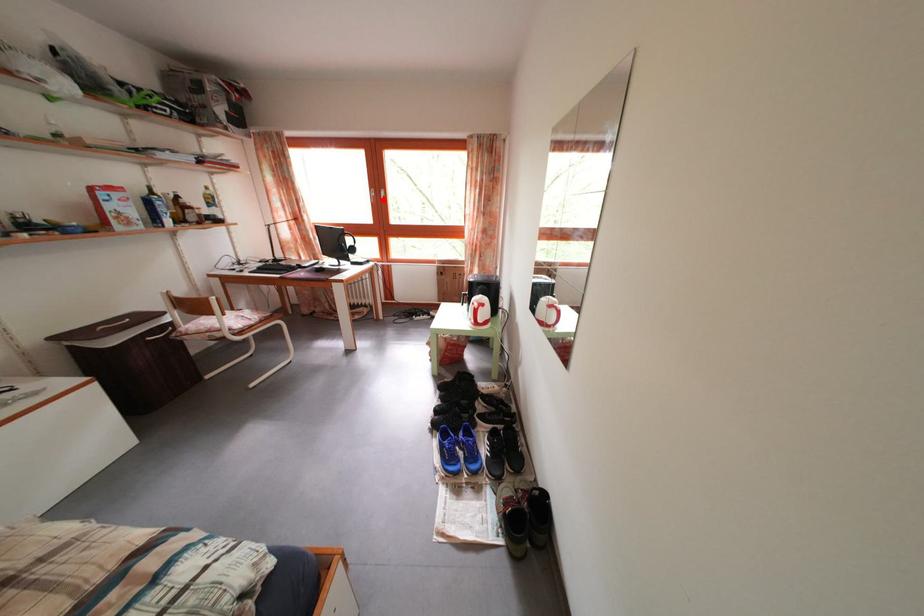
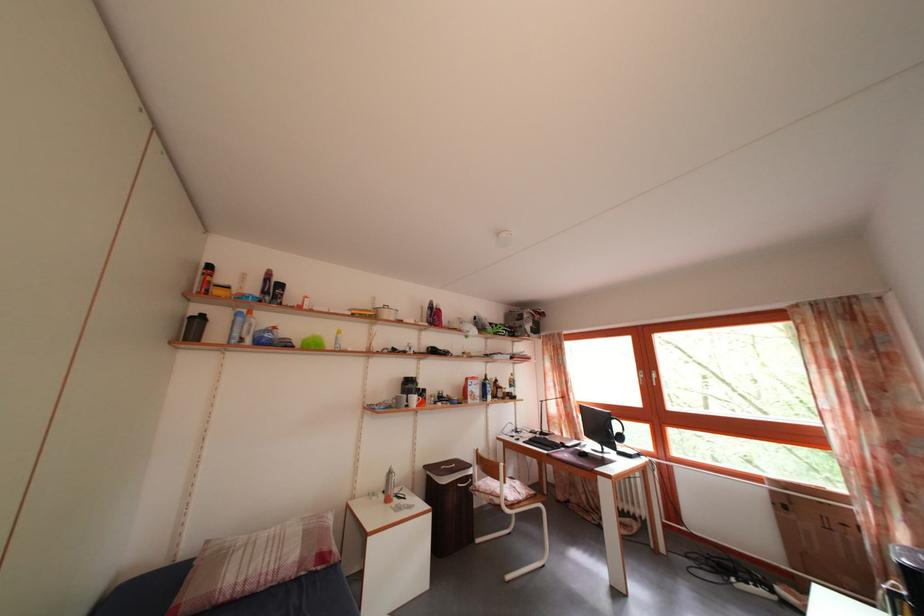
Where in the second image is the point corresponding to the highlighted location from the first image?

(652, 382)